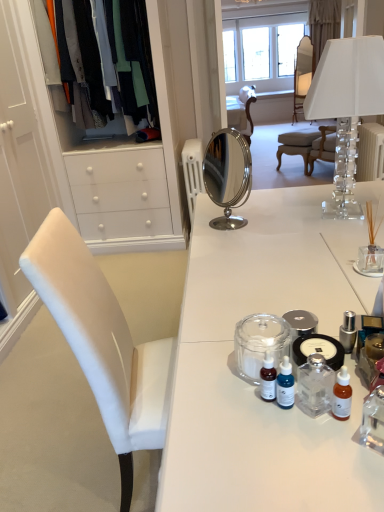
Where is `transparent glass jar at center`? This screenshot has width=384, height=512. transparent glass jar at center is located at coordinates (260, 343).

You are a GUI agent. You are given a task and a screenshot of the screen. Output one action in this format:
    pyautogui.click(x=<x>, y=<y>)
    Task: Click on the silver metallic container at center-right, the first toiletry in the right-to-left sequence
    The height and width of the screenshot is (512, 384).
    Given the screenshot: What is the action you would take?
    pyautogui.click(x=348, y=331)

Where is `silky cotton shirts at upper left`? The height and width of the screenshot is (512, 384). silky cotton shirts at upper left is located at coordinates (135, 63).

Find the location of a particular element. This screenshot has height=512, width=384. transparent glass jar at center is located at coordinates tap(260, 343).

In the scene shown: Is silver metallic container at center-right, marked as the 1th toiletry in a back-to-front arrangement, located outside white glossy desk at center?

Absolutely, silver metallic container at center-right, marked as the 1th toiletry in a back-to-front arrangement, is external to white glossy desk at center.

Is silver metallic container at center-right, the first toiletry in the right-to-left sequence, directly adjacent to white glossy desk at center?

silver metallic container at center-right, the first toiletry in the right-to-left sequence, and white glossy desk at center are clearly separated.

Which of these two, silver metallic container at center-right, the first toiletry in the right-to-left sequence, or white glossy desk at center, is smaller?

silver metallic container at center-right, the first toiletry in the right-to-left sequence, is smaller.

From the image's perspective, is silky cotton shirts at upper left located above silver metallic container at center-right, the second toiletry when ordered from front to back?

Correct, silky cotton shirts at upper left appears higher than silver metallic container at center-right, the second toiletry when ordered from front to back, in the image.

Which object is further away from the camera, silky cotton shirts at upper left or silver metallic container at center-right, the second toiletry when ordered from front to back?

silky cotton shirts at upper left.

Based on the photo, which object is positioned more to the left, silky cotton shirts at upper left or silver metallic container at center-right, the first toiletry in the right-to-left sequence?

silky cotton shirts at upper left.

Does silky cotton shirts at upper left have a lesser width compared to silver metallic container at center-right, the second toiletry when ordered from front to back?

In fact, silky cotton shirts at upper left might be wider than silver metallic container at center-right, the second toiletry when ordered from front to back.

The height and width of the screenshot is (512, 384). Identify the location of the 2nd toiletry counting from the left side of the light brown wooden chair at center, which ranks as the 1th chair in bottom-to-top order. (285, 384).

Considering the positions of objects blue glass dropper bottle at center, which ranks as the second toiletry in right-to-left order, and light brown wooden chair at center, which ranks as the 1th chair in bottom-to-top order, in the image provided, who is in front, blue glass dropper bottle at center, which ranks as the second toiletry in right-to-left order, or light brown wooden chair at center, which ranks as the 1th chair in bottom-to-top order,?

blue glass dropper bottle at center, which ranks as the second toiletry in right-to-left order, is closer to the camera.

What's the angular difference between blue glass dropper bottle at center, which ranks as the second toiletry in right-to-left order, and light brown wooden chair at center, which ranks as the 1th chair in bottom-to-top order,'s facing directions?

The angular difference between blue glass dropper bottle at center, which ranks as the second toiletry in right-to-left order, and light brown wooden chair at center, which ranks as the 1th chair in bottom-to-top order, is 36.3 degrees.

Would you say blue glass dropper bottle at center, the 2th toiletry when ordered from back to front, is outside light brown wooden chair at center, positioned as the 2th chair in right-to-left order?

blue glass dropper bottle at center, the 2th toiletry when ordered from back to front, is positioned outside light brown wooden chair at center, positioned as the 2th chair in right-to-left order.

Between clear crystal lampshade at upper right and light brown wooden chair at center, positioned as the 2th chair in right-to-left order, which one has smaller size?

Smaller between the two is clear crystal lampshade at upper right.

Is clear crystal lampshade at upper right in front of light brown wooden chair at center, which is the 1th chair in front-to-back order?

Yes, clear crystal lampshade at upper right is closer to the viewer.

Considering the relative sizes of clear crystal lampshade at upper right and light brown wooden chair at center, which is the 1th chair in front-to-back order, in the image provided, is clear crystal lampshade at upper right shorter than light brown wooden chair at center, which is the 1th chair in front-to-back order,?

No.

Is clear crystal lampshade at upper right next to light brown wooden chair at center, which ranks as the 1th chair in bottom-to-top order?

No, clear crystal lampshade at upper right is not with light brown wooden chair at center, which ranks as the 1th chair in bottom-to-top order.

From the image's perspective, which one is positioned higher, white glossy desk at center or matte white chair at center, which is the 2th chair in front-to-back order?

matte white chair at center, which is the 2th chair in front-to-back order.

Who is taller, white glossy desk at center or matte white chair at center, the 1th chair from the top?

matte white chair at center, the 1th chair from the top.

Which point is more forward, (329,245) or (312,77)?

The point (329,245) is in front.

From a real-world perspective, is white glossy desk at center under matte white chair at center, which is the 1th chair in right-to-left order?

Correct, in the physical world, white glossy desk at center is lower than matte white chair at center, which is the 1th chair in right-to-left order.

Is light brown wooden chair at center, which ranks as the 1th chair in bottom-to-top order, spatially inside clear glass bottle at center, or outside of it?

light brown wooden chair at center, which ranks as the 1th chair in bottom-to-top order, exists outside the volume of clear glass bottle at center.

The height and width of the screenshot is (512, 384). What are the coordinates of `bottle on the left of light brown wooden chair at center, which appears as the 1th chair when viewed from the left` in the screenshot? It's located at (315, 386).

Is clear glass bottle at center at the back of light brown wooden chair at center, which ranks as the 1th chair in bottom-to-top order?

No, light brown wooden chair at center, which ranks as the 1th chair in bottom-to-top order, is not facing the opposite direction of clear glass bottle at center.

Considering the relative positions of light brown wooden chair at center, positioned as the 2th chair in right-to-left order, and clear glass bottle at center in the image provided, is light brown wooden chair at center, positioned as the 2th chair in right-to-left order, to the right of clear glass bottle at center from the viewer's perspective?

Yes.

From a real-world perspective, does clear crystal lampshade at upper right sit lower than blue glass dropper bottle at center, arranged as the first toiletry when viewed from the left?

Incorrect, from a real-world perspective, clear crystal lampshade at upper right is higher than blue glass dropper bottle at center, arranged as the first toiletry when viewed from the left.

Can you confirm if clear crystal lampshade at upper right is shorter than blue glass dropper bottle at center, which ranks as the second toiletry in right-to-left order?

Incorrect, the height of clear crystal lampshade at upper right does not fall short of that of blue glass dropper bottle at center, which ranks as the second toiletry in right-to-left order.

Is clear crystal lampshade at upper right turned away from blue glass dropper bottle at center, which is the 1th toiletry in front-to-back order?

That's not correct — clear crystal lampshade at upper right is not looking away from blue glass dropper bottle at center, which is the 1th toiletry in front-to-back order.

Looking at this image, considering the relative sizes of clear crystal lampshade at upper right and blue glass dropper bottle at center, the 2th toiletry when ordered from back to front, in the image provided, is clear crystal lampshade at upper right thinner than blue glass dropper bottle at center, the 2th toiletry when ordered from back to front,?

No.

Identify the location of desk on the left of silver metallic container at center-right, the first toiletry in the right-to-left sequence. (256, 386).

In the image, there is a silver metallic container at center-right, the 2th toiletry from the left. Identify the location of clothing above it (from the image's perspective). (135, 63).

From the image, which object appears to be nearer to white glossy desk at center, light brown wooden chair at center, which appears as the 1th chair when viewed from the left, or silky cotton shirts at upper left?

silky cotton shirts at upper left lies closer to white glossy desk at center than the other object.

Based on the photo, when comparing their distances from transparent glass jar at center, does white fabric curtain at upper center or clear glass bottle at center seem further?

Among the two, white fabric curtain at upper center is located further to transparent glass jar at center.

From the image, which object appears to be farther from silky cotton shirts at upper left, clear glass bottle at center or white glossy desk at center?

clear glass bottle at center is positioned further to the anchor silky cotton shirts at upper left.

Which object lies further to the anchor point silver metallic container at center-right, the 2th toiletry from the left, silky cotton shirts at upper left or white glossy desk at center?

silky cotton shirts at upper left is further to silver metallic container at center-right, the 2th toiletry from the left.

Based on their spatial positions, is transparent glass jar at center or white fabric curtain at upper center closer to silver metallic container at center-right, the second toiletry when ordered from front to back?

transparent glass jar at center.

When comparing their distances from white glossy desk at center, does silver metallic container at center-right, the first toiletry in the right-to-left sequence, or clear crystal lampshade at upper right seem further?

The object further to white glossy desk at center is clear crystal lampshade at upper right.

Considering their positions, is clear crystal lampshade at upper right positioned further to matte white chair at center, which is the 2th chair in front-to-back order, than white glossy desk at center?

white glossy desk at center is positioned further to the anchor matte white chair at center, which is the 2th chair in front-to-back order.

Based on the photo, estimate the real-world distances between objects in this image. Which object is further from silky cotton shirts at upper left, silver metallic container at center-right, marked as the 1th toiletry in a back-to-front arrangement, or clear glass bottle at center?

clear glass bottle at center.

Image resolution: width=384 pixels, height=512 pixels. In order to click on toiletry between clear crystal lampshade at upper right and transparent glass jar at center from top to bottom in this screenshot , I will do `click(348, 331)`.

This screenshot has height=512, width=384. Identify the location of toiletry between transparent glass jar at center and matte white chair at center, which is the 2th chair in front-to-back order, from front to back. click(348, 331).

Where is `toiletry between transparent glass jar at center and silver metallic container at center-right, the 2th toiletry from the left`? This screenshot has height=512, width=384. toiletry between transparent glass jar at center and silver metallic container at center-right, the 2th toiletry from the left is located at coordinates click(x=285, y=384).

The height and width of the screenshot is (512, 384). I want to click on toiletry between transparent glass jar at center and white fabric curtain at upper center from front to back, so click(x=348, y=331).